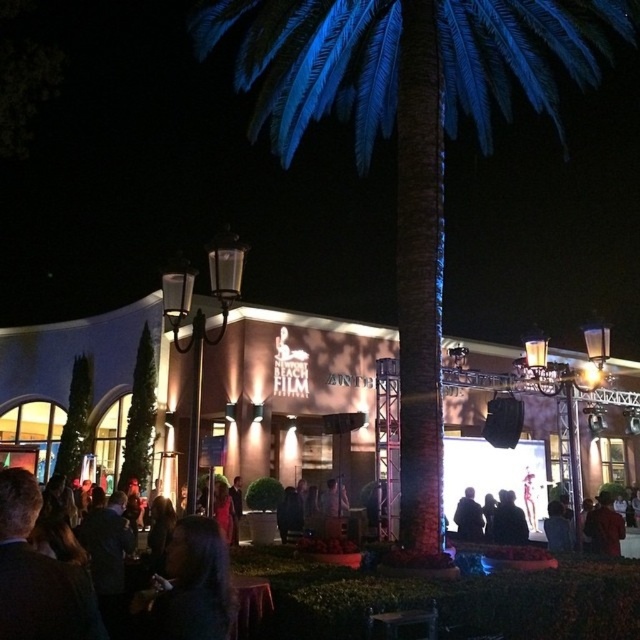
You are attending the Newport Beach Film Festival and standing at the entrance of the building. You notice two points marked on the ground in front of you. The first point is at coordinates point (x=36, y=602) and the second is at point (x=492, y=522). Which point is closer to you?

Point (x=36, y=602) is closer to the viewer than point (x=492, y=522).

You are attending the Newport Beach Film Festival and notice the blue artificial palm tree at center and the dark blue fabric jacket at center. Which object is wider?

The blue artificial palm tree at center is wider than the dark blue fabric jacket at center.